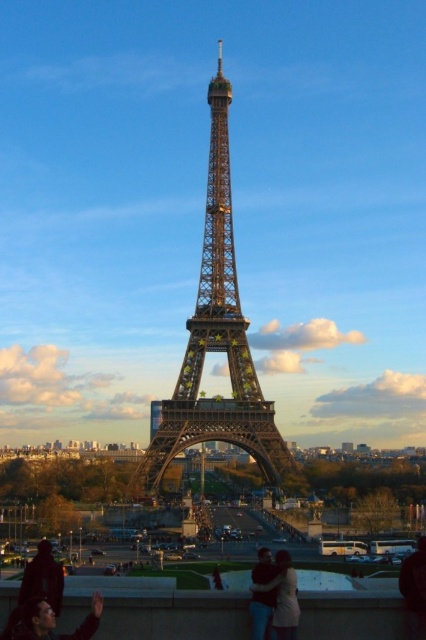
Can you confirm if matte black hair at lower left is positioned to the right of light brown leather jacket at lower center?

In fact, matte black hair at lower left is to the left of light brown leather jacket at lower center.

Which is above, matte black hair at lower left or light brown leather jacket at lower center?

light brown leather jacket at lower center is higher up.

Is point (5, 632) behind point (267, 636)?

Yes.

Locate an element on the screen. The width and height of the screenshot is (426, 640). matte black hair at lower left is located at coordinates (48, 621).

In the scene shown: Can you confirm if metallic structure at center is taller than light brown leather jacket at lower center?

Yes, metallic structure at center is taller than light brown leather jacket at lower center.

Does metallic structure at center have a greater width compared to light brown leather jacket at lower center?

Indeed, metallic structure at center has a greater width compared to light brown leather jacket at lower center.

This screenshot has height=640, width=426. I want to click on metallic structure at center, so click(216, 339).

Locate an element on the screen. metallic structure at center is located at coordinates (216, 339).

How distant is metallic structure at center from matte black hair at lower left?

The distance of metallic structure at center from matte black hair at lower left is 34.45 meters.

Who is more distant from viewer, (218, 76) or (97, 618)?

Positioned behind is point (218, 76).

Where is `metallic structure at center`? Image resolution: width=426 pixels, height=640 pixels. metallic structure at center is located at coordinates (216, 339).